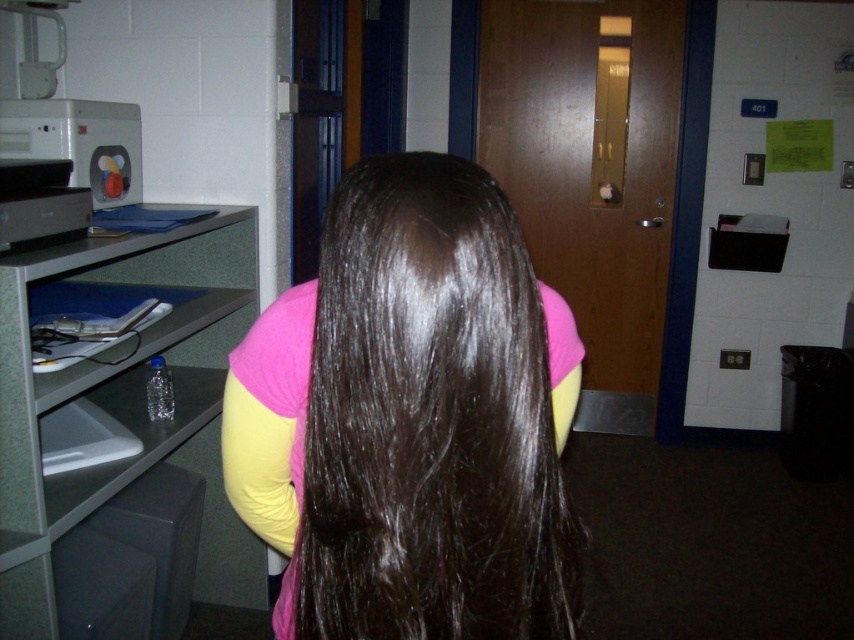
Question: Among these points, which one is nearest to the camera?

Choices:
 (A) (262, 390)
 (B) (180, 260)

Answer: (A)

Question: Is shiny brown hair at center in front of gray plastic file cabinet at left?

Choices:
 (A) yes
 (B) no

Answer: (A)

Question: Which point appears farthest from the camera in this image?

Choices:
 (A) (576, 618)
 (B) (114, 552)

Answer: (B)

Question: Which point is closer to the camera?

Choices:
 (A) (0, 394)
 (B) (357, 220)

Answer: (B)

Question: Is shiny brown hair at center below gray plastic file cabinet at left?

Choices:
 (A) no
 (B) yes

Answer: (B)

Question: Is shiny brown hair at center in front of gray plastic file cabinet at left?

Choices:
 (A) yes
 (B) no

Answer: (A)